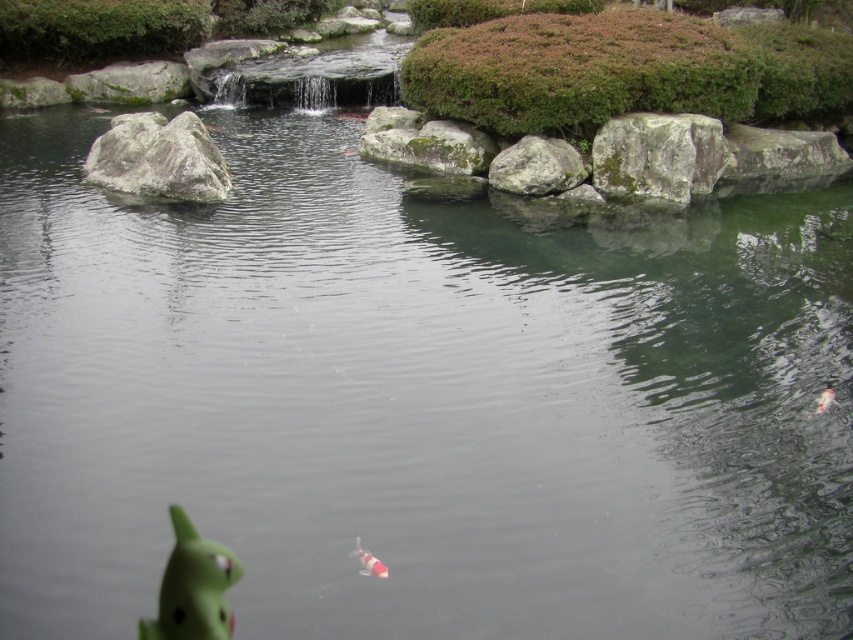
Is gray rough rock at left shorter than white glossy fish at lower right?

In fact, gray rough rock at left may be taller than white glossy fish at lower right.

Is gray rough rock at left wider than white glossy fish at lower right?

Correct, the width of gray rough rock at left exceeds that of white glossy fish at lower right.

Which is in front, point (181, 193) or point (819, 412)?

Point (819, 412) is in front.

This screenshot has height=640, width=853. Find the location of `gray rough rock at left`. gray rough rock at left is located at coordinates (158, 157).

Which is behind, point (724, 157) or point (184, 145)?

The point (724, 157) is more distant.

I want to click on gray rough rock at upper right, so click(659, 156).

Measure the distance between gray rough rock at left and camera.

gray rough rock at left is 11.55 meters away from camera.

Looking at this image, does gray rough rock at left appear over gray rough rock at center?

Indeed, gray rough rock at left is positioned over gray rough rock at center.

The width and height of the screenshot is (853, 640). Describe the element at coordinates (158, 157) in the screenshot. I see `gray rough rock at left` at that location.

Identify the location of gray rough rock at left. This screenshot has height=640, width=853. (158, 157).